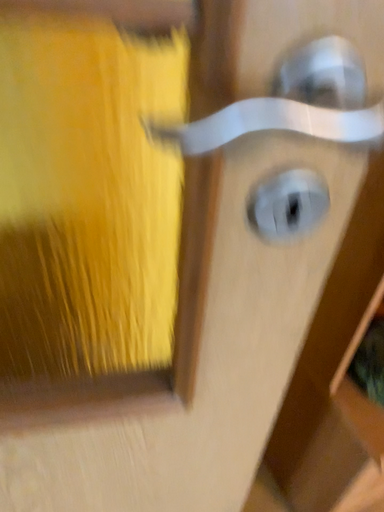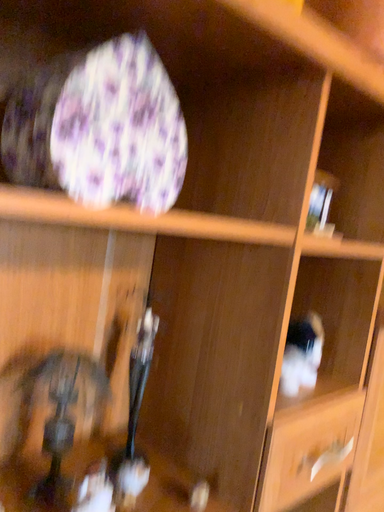
Question: How did the camera likely rotate when shooting the video?

Choices:
 (A) rotated right
 (B) rotated left

Answer: (A)